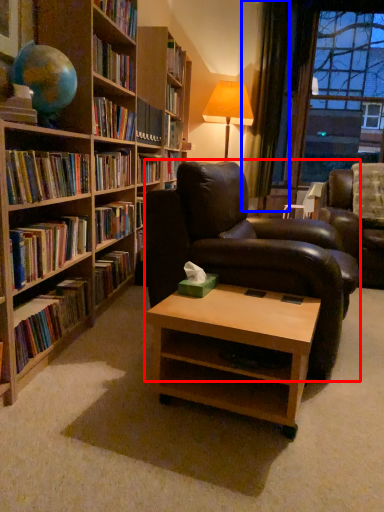
Question: Which of the following is the closest to the observer, chair (highlighted by a red box) or curtain (highlighted by a blue box)?

Choices:
 (A) chair
 (B) curtain

Answer: (A)